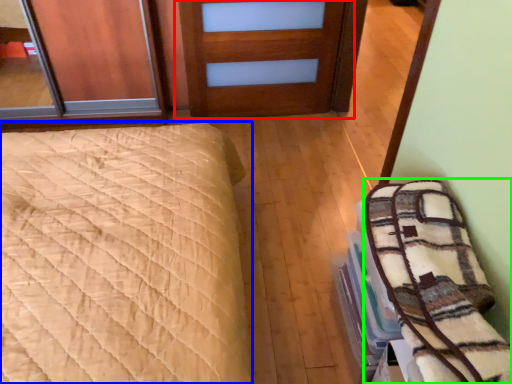
Question: Which is farther away from door (highlighted by a red box)? bed (highlighted by a blue box) or bedding (highlighted by a green box)?

Choices:
 (A) bed
 (B) bedding

Answer: (B)